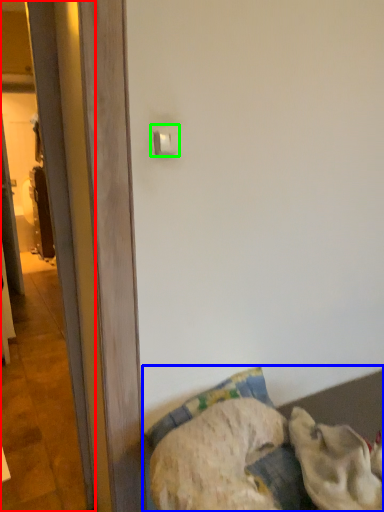
Question: Considering the real-world distances, which object is closest to screen door (highlighted by a red box)? furniture (highlighted by a blue box) or light switch (highlighted by a green box).

Choices:
 (A) furniture
 (B) light switch

Answer: (B)